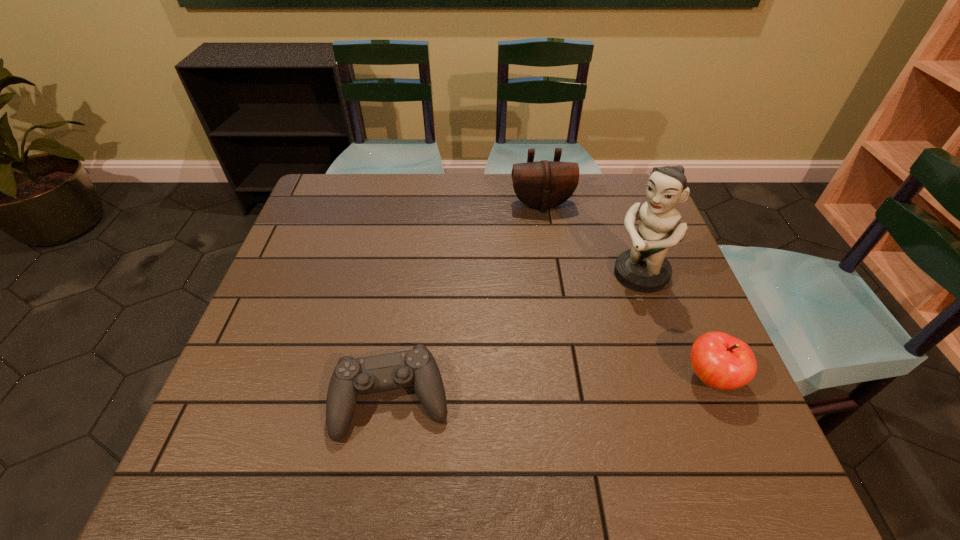
Where is `object that is positioned at the near right corner`? object that is positioned at the near right corner is located at coordinates pyautogui.click(x=721, y=361).

Where is `blank area at the far edge`? This screenshot has height=540, width=960. blank area at the far edge is located at coordinates (444, 200).

Locate an element on the screen. This screenshot has height=540, width=960. free spot at the near edge of the desktop is located at coordinates (476, 413).

The height and width of the screenshot is (540, 960). I want to click on free point at the left edge, so click(324, 227).

At what (x,y) coordinates should I click in order to perform the action: click on free point at the far left corner. Please return your answer as a coordinate pair (x, y). The width and height of the screenshot is (960, 540). Looking at the image, I should click on (354, 217).

Locate an element on the screen. The image size is (960, 540). vacant area between the apple and the control is located at coordinates (551, 389).

At what (x,y) coordinates should I click in order to perform the action: click on empty space between the control and the tallest object. Please return your answer as a coordinate pair (x, y). The height and width of the screenshot is (540, 960). Looking at the image, I should click on (516, 337).

You are a GUI agent. You are given a task and a screenshot of the screen. Output one action in this format:
    pyautogui.click(x=<x>, y=<y>)
    Task: Click on the vacant point located between the second farthest object and the control
    This screenshot has height=540, width=960.
    Given the screenshot: What is the action you would take?
    pyautogui.click(x=516, y=337)

Find the location of `free area in between the control and the figurine`. free area in between the control and the figurine is located at coordinates (516, 337).

Where is `unoccupied area between the leftmost object and the tallest object`? The image size is (960, 540). unoccupied area between the leftmost object and the tallest object is located at coordinates (516, 337).